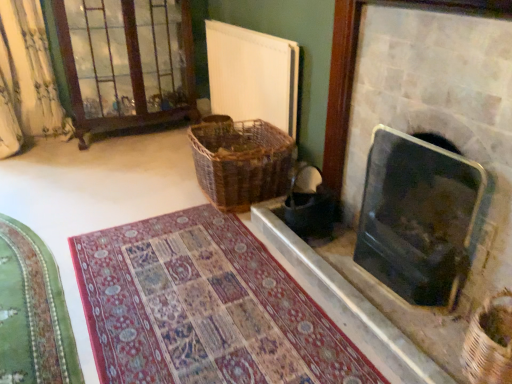
The width and height of the screenshot is (512, 384). What are the coordinates of `free point below brown wooden glass door at upper left (from a real-world perspective)` in the screenshot? It's located at (132, 138).